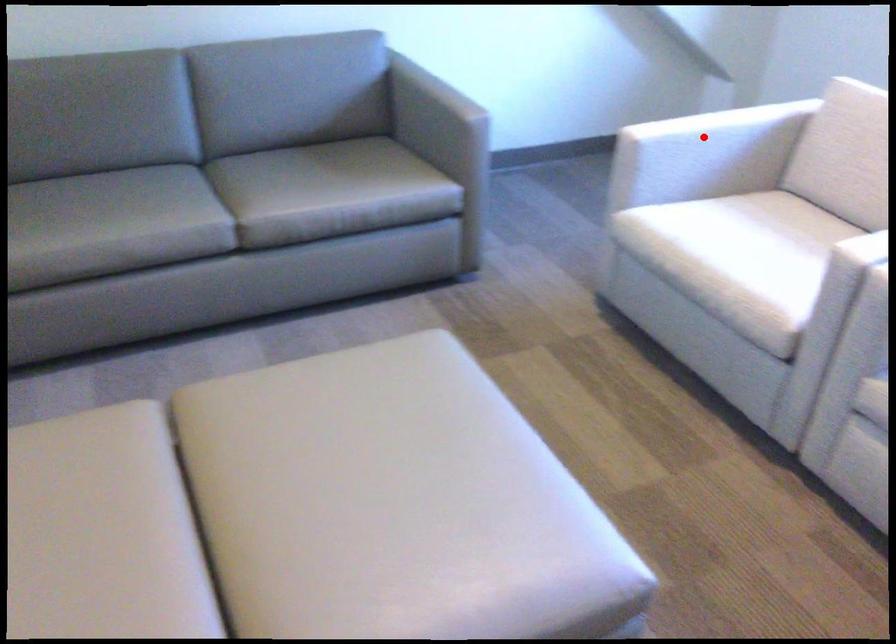
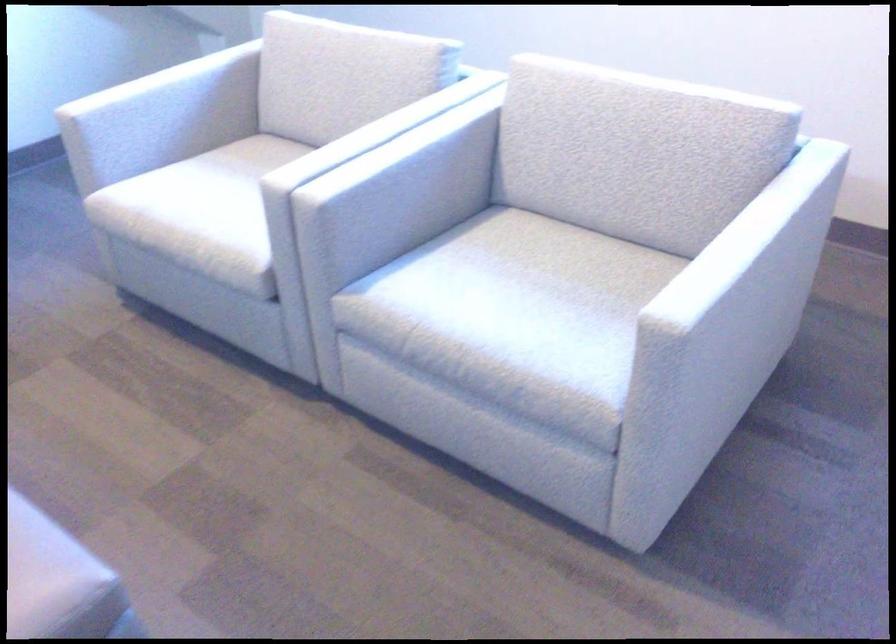
Find the pixel in the second image that matches the highlighted location in the first image.

(150, 96)